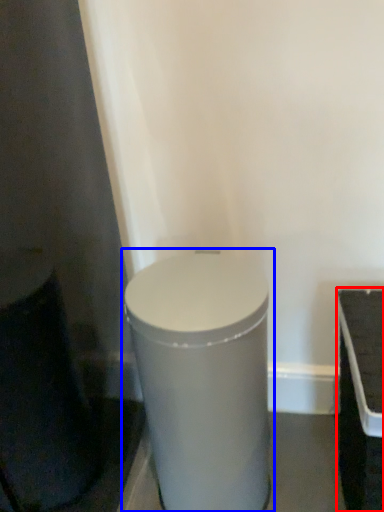
Question: Which object is further to the camera taking this photo, table (highlighted by a red box) or waste container (highlighted by a blue box)?

Choices:
 (A) table
 (B) waste container

Answer: (B)